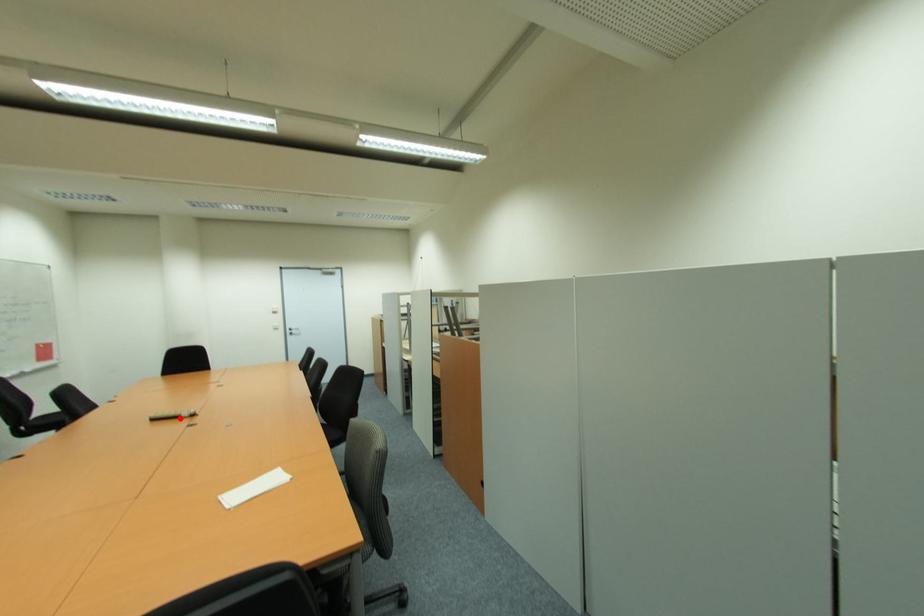
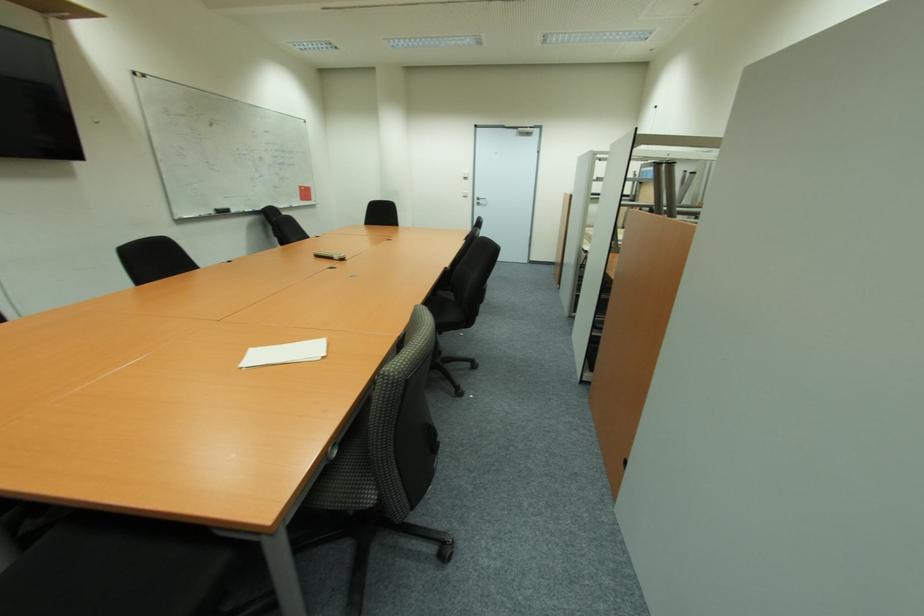
In the second image, find the point that corresponds to the highlighted location in the first image.

(334, 259)